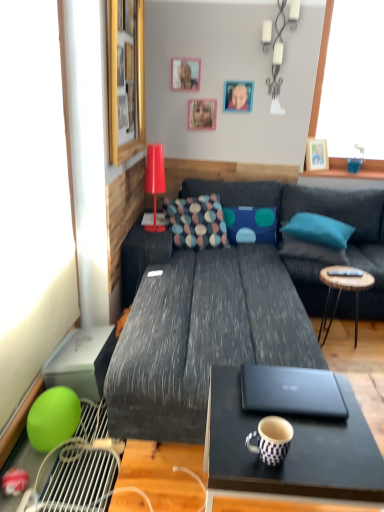
At what (x,y) coordinates should I click in order to perform the action: click on wooden picture frame at upper right, which ranks as the 1th picture frame in right-to-left order. Please return your answer as a coordinate pair (x, y). This screenshot has height=512, width=384. Looking at the image, I should click on 316,154.

Measure the distance between matte black coffee table at lower right and camera.

matte black coffee table at lower right and camera are 3.45 feet apart from each other.

You are a GUI agent. You are given a task and a screenshot of the screen. Output one action in this format:
    pyautogui.click(x=<x>, y=<y>)
    Task: Click on the dark gray fabric couch at center
    The height and width of the screenshot is (512, 384).
    Given the screenshot: What is the action you would take?
    pyautogui.click(x=203, y=329)

The image size is (384, 512). I want to click on blue fabric pillow at center, acting as the 3th pillow starting from the right, so click(x=250, y=224).

Locate an element on the screen. The image size is (384, 512). silver metallic candle holder at upper center is located at coordinates (280, 54).

Can you confirm if teal fabric pillow at center, which is counted as the 1th pillow, starting from the right, is smaller than wooden round table at right?

Incorrect, teal fabric pillow at center, which is counted as the 1th pillow, starting from the right, is not smaller in size than wooden round table at right.

Choose the correct answer: Is teal fabric pillow at center, positioned as the fourth pillow in left-to-right order, inside wooden round table at right or outside it?

teal fabric pillow at center, positioned as the fourth pillow in left-to-right order, is not inside wooden round table at right, it's outside.

From the image's perspective, would you say multicolored fabric pillow at center, which appears as the 1th pillow when viewed from the left, is shown under matte black coffee table at lower right?

A: No.

Based on the photo, which point is more distant from viewer, (194, 246) or (223, 432)?

The point (194, 246) is farther from the camera.

Looking at this image, between multicolored fabric pillow at center, which appears as the 1th pillow when viewed from the left, and matte black coffee table at lower right, which one is positioned behind?

multicolored fabric pillow at center, which appears as the 1th pillow when viewed from the left, is further away from the camera.

How different are the orientations of multicolored fabric pillow at center, which appears as the 1th pillow when viewed from the left, and matte black coffee table at lower right in degrees?

76.2 degrees.

Is blue fabric pillow at center, acting as the 3th pillow starting from the right, completely or partially inside blue and white checkered coffee cup at lower center?

No, blue fabric pillow at center, acting as the 3th pillow starting from the right, is not surrounded by blue and white checkered coffee cup at lower center.

From a real-world perspective, is blue and white checkered coffee cup at lower center located beneath blue fabric pillow at center, acting as the 3th pillow starting from the right?

Incorrect, from a real-world perspective, blue and white checkered coffee cup at lower center is higher than blue fabric pillow at center, acting as the 3th pillow starting from the right.

Considering the sizes of objects blue and white checkered coffee cup at lower center and blue fabric pillow at center, arranged as the 2th pillow when viewed from the left, in the image provided, who is taller, blue and white checkered coffee cup at lower center or blue fabric pillow at center, arranged as the 2th pillow when viewed from the left,?

Standing taller between the two is blue fabric pillow at center, arranged as the 2th pillow when viewed from the left.

Is gold wooden picture frame at upper left, which ranks as the first picture frame in left-to-right order, inside the boundaries of pink matte picture frame at upper center, acting as the 2th picture frame starting from the back, or outside?

gold wooden picture frame at upper left, which ranks as the first picture frame in left-to-right order, is not inside pink matte picture frame at upper center, acting as the 2th picture frame starting from the back, it's outside.

Considering the positions of points (117, 63) and (188, 101), is point (117, 63) farther from camera compared to point (188, 101)?

No, it is not.

Between gold wooden picture frame at upper left, which ranks as the first picture frame in left-to-right order, and pink matte picture frame at upper center, which is the 2th picture frame from right to left, which one has smaller width?

Thinner between the two is pink matte picture frame at upper center, which is the 2th picture frame from right to left.

Is the surface of gold wooden picture frame at upper left, which appears as the 4th picture frame when viewed from the right, in direct contact with pink matte picture frame at upper center, placed as the 3th picture frame when sorted from front to back?

No, gold wooden picture frame at upper left, which appears as the 4th picture frame when viewed from the right, is not making contact with pink matte picture frame at upper center, placed as the 3th picture frame when sorted from front to back.

Does gold wooden picture frame at upper left, which appears as the 4th picture frame when viewed from the right, lie behind blue fabric portrait at upper center?

No, the depth of gold wooden picture frame at upper left, which appears as the 4th picture frame when viewed from the right, is less than that of blue fabric portrait at upper center.

Are gold wooden picture frame at upper left, which ranks as the first picture frame in left-to-right order, and blue fabric portrait at upper center beside each other?

gold wooden picture frame at upper left, which ranks as the first picture frame in left-to-right order, and blue fabric portrait at upper center are not in contact.

Is gold wooden picture frame at upper left, which ranks as the first picture frame in left-to-right order, shorter than blue fabric portrait at upper center?

In fact, gold wooden picture frame at upper left, which ranks as the first picture frame in left-to-right order, may be taller than blue fabric portrait at upper center.

Where is `person above the gold wooden picture frame at upper left, the first picture frame when ordered from front to back (from the image's perspective)`? This screenshot has height=512, width=384. person above the gold wooden picture frame at upper left, the first picture frame when ordered from front to back (from the image's perspective) is located at coordinates (239, 98).

Identify the location of pillow that is the 4th object to the left of the wooden picture frame at upper right, which ranks as the 1th picture frame in right-to-left order, starting at the anchor. (196, 221).

What's the angular difference between wooden picture frame at upper right, which ranks as the 1th picture frame in right-to-left order, and multicolored fabric pillow at center, which appears as the 1th pillow when viewed from the left,'s facing directions?

There is a 14.3-degree angle between the facing directions of wooden picture frame at upper right, which ranks as the 1th picture frame in right-to-left order, and multicolored fabric pillow at center, which appears as the 1th pillow when viewed from the left.

Considering the sizes of objects wooden picture frame at upper right, the fourth picture frame from the front, and multicolored fabric pillow at center, which appears as the 1th pillow when viewed from the left, in the image provided, who is thinner, wooden picture frame at upper right, the fourth picture frame from the front, or multicolored fabric pillow at center, which appears as the 1th pillow when viewed from the left,?

Thinner between the two is wooden picture frame at upper right, the fourth picture frame from the front.

Is wooden picture frame at upper right, acting as the 1th picture frame starting from the back, completely or partially outside of multicolored fabric pillow at center, the fourth pillow when ordered from right to left?

Yes.

Measure the distance from blue fabric pillow at center, acting as the 3th pillow starting from the right, to black matte laptop at lower center.

blue fabric pillow at center, acting as the 3th pillow starting from the right, and black matte laptop at lower center are 1.76 meters apart from each other.

Which object is closer to the camera taking this photo, blue fabric pillow at center, arranged as the 2th pillow when viewed from the left, or black matte laptop at lower center?

Positioned in front is black matte laptop at lower center.

Who is taller, blue fabric pillow at center, arranged as the 2th pillow when viewed from the left, or black matte laptop at lower center?

With more height is blue fabric pillow at center, arranged as the 2th pillow when viewed from the left.

Can you tell me how much blue fabric pillow at center, arranged as the 2th pillow when viewed from the left, and black matte laptop at lower center differ in facing direction?

The facing directions of blue fabric pillow at center, arranged as the 2th pillow when viewed from the left, and black matte laptop at lower center are 83 degrees apart.

I want to click on table below the teal fabric pillow at center, which is counted as the 1th pillow, starting from the right (from a real-world perspective), so click(x=342, y=290).

Where is `coffee table below the multicolored fabric pillow at center, which appears as the 1th pillow when viewed from the left (from the image's perspective)`? Image resolution: width=384 pixels, height=512 pixels. coffee table below the multicolored fabric pillow at center, which appears as the 1th pillow when viewed from the left (from the image's perspective) is located at coordinates click(291, 454).

From the image, which object appears to be farther from matte black coffee table at lower right, blue and white checkered coffee cup at lower center or silver metallic candle holder at upper center?

The object further to matte black coffee table at lower right is silver metallic candle holder at upper center.

Based on their spatial positions, is blue fabric pillow at center, acting as the 3th pillow starting from the right, or multicolored fabric pillow at center, which appears as the 1th pillow when viewed from the left, further from black matte laptop at lower center?

Among the two, blue fabric pillow at center, acting as the 3th pillow starting from the right, is located further to black matte laptop at lower center.

When comparing their distances from wooden round table at right, does teal fabric pillow at right, the 3th pillow from the left, or pink matte picture frame at upper center, which is the third picture frame from left to right, seem further?

pink matte picture frame at upper center, which is the third picture frame from left to right, lies further to wooden round table at right than the other object.

Estimate the real-world distances between objects in this image. Which object is closer to black matte laptop at lower center, wooden picture frame at upper center, which is counted as the 2th picture frame, starting from the front, or multicolored fabric pillow at center, the fourth pillow when ordered from right to left?

multicolored fabric pillow at center, the fourth pillow when ordered from right to left, is positioned closer to the anchor black matte laptop at lower center.

From the image, which object appears to be nearer to dark gray fabric couch at center, black matte laptop at lower center or multicolored fabric pillow at center, the fourth pillow when ordered from right to left?

multicolored fabric pillow at center, the fourth pillow when ordered from right to left, is closer to dark gray fabric couch at center.

Looking at the image, which one is located further to wooden picture frame at upper right, acting as the 1th picture frame starting from the back, blue fabric portrait at upper center or matte black coffee table at lower right?

The object further to wooden picture frame at upper right, acting as the 1th picture frame starting from the back, is matte black coffee table at lower right.

Based on their spatial positions, is teal fabric pillow at right, which ranks as the second pillow in right-to-left order, or black matte laptop at lower center closer to pink matte picture frame at upper center, placed as the 3th picture frame when sorted from front to back?

Among the two, teal fabric pillow at right, which ranks as the second pillow in right-to-left order, is located nearer to pink matte picture frame at upper center, placed as the 3th picture frame when sorted from front to back.

Considering their positions, is blue and white checkered coffee cup at lower center positioned closer to blue fabric portrait at upper center than multicolored fabric pillow at center, the fourth pillow when ordered from right to left?

Among the two, multicolored fabric pillow at center, the fourth pillow when ordered from right to left, is located nearer to blue fabric portrait at upper center.

In order to click on table between blue and white checkered coffee cup at lower center and matte red table lamp at upper center in the front-back direction in this screenshot , I will do `click(342, 290)`.

The width and height of the screenshot is (384, 512). Find the location of `laptop between blue and white checkered coffee cup at lower center and wooden round table at right in the front-back direction`. laptop between blue and white checkered coffee cup at lower center and wooden round table at right in the front-back direction is located at coordinates (292, 392).

Identify the location of table between blue fabric portrait at upper center and green rubber ball at lower left vertically. (x=342, y=290).

At what (x,y) coordinates should I click in order to perform the action: click on laptop between wooden picture frame at upper center, which is counted as the 2th picture frame, starting from the front, and matte black coffee table at lower right in the up-down direction. Please return your answer as a coordinate pair (x, y). Looking at the image, I should click on (292, 392).